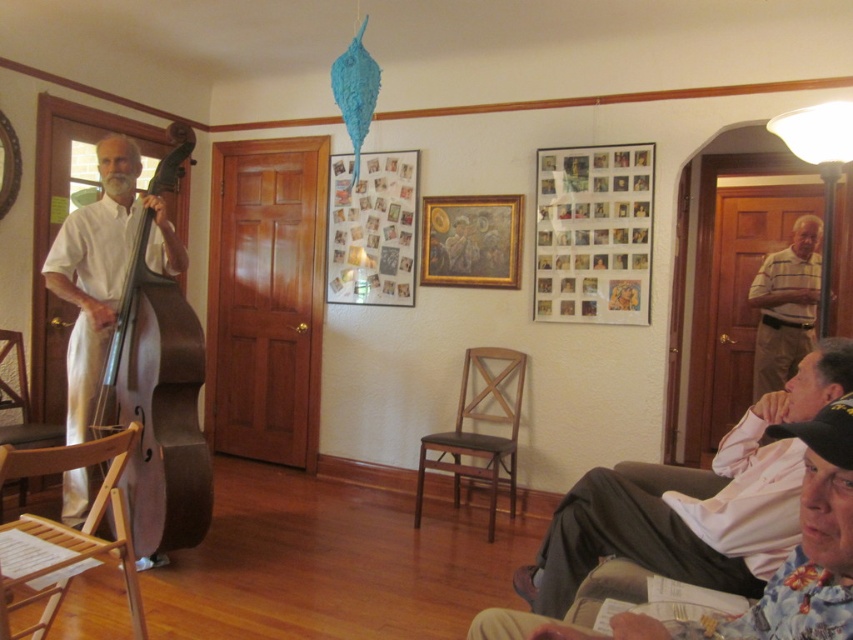
You are a photographer setting up a shoot in this room. You need to place a large camera tripod between the matte brown cello at left and the wooden armchair at left. Is there enough space between them to set up the tripod?

The matte brown cello at left is positioned over the wooden armchair at left, meaning they are in the same location or very close. There is likely not enough space to place a large camera tripod between them.

You are a photographer standing in the room and want to take a photo of the matte brown cello at left and the wooden armchair at left. Which object will appear larger in the photo?

The matte brown cello at left will appear larger in the photo because it is closer to the viewer than the wooden armchair at left.

You are organizing a small concert in the living room and need to place a decorative metallic silver photo frame at upper right and a brown wood chair at center. Given their sizes, which object should you place first to ensure there is enough space for both?

The metallic silver photo frame at upper right is smaller than the brown wood chair at center, so you should place the brown wood chair at center first to ensure there is enough space for both.